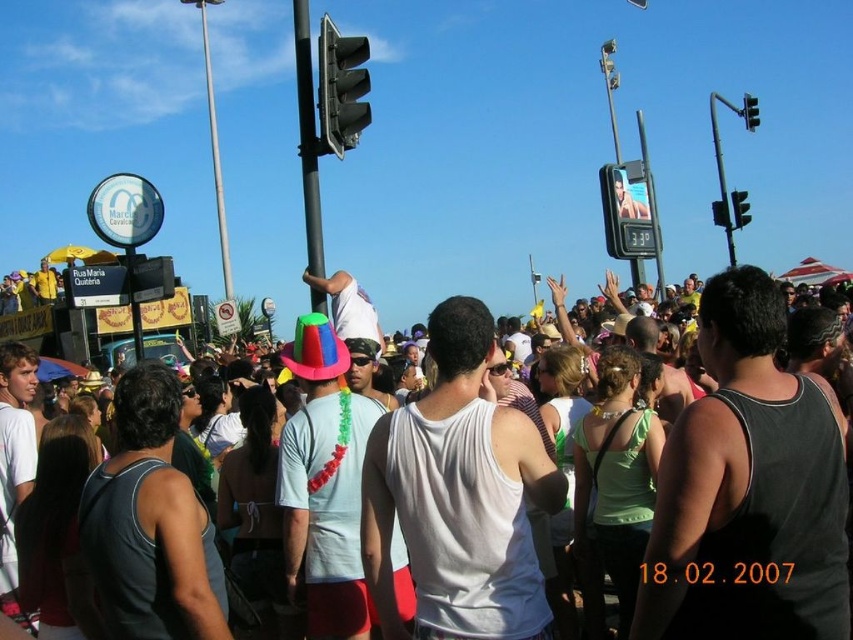
Can you confirm if metallic gray traffic light at upper center is positioned above black plastic traffic light at upper right?

Indeed, metallic gray traffic light at upper center is positioned over black plastic traffic light at upper right.

Between point (364, 38) and point (746, 214), which one is positioned behind?

The point (746, 214) is more distant.

At what (x,y) coordinates should I click in order to perform the action: click on metallic gray traffic light at upper center. Please return your answer as a coordinate pair (x, y). The width and height of the screenshot is (853, 640). Looking at the image, I should click on (341, 88).

Who is shorter, metallic pole at center or metallic traffic light at upper right?

Standing shorter between the two is metallic traffic light at upper right.

Can you confirm if metallic pole at center is shorter than metallic traffic light at upper right?

No, metallic pole at center is not shorter than metallic traffic light at upper right.

Is point (306, 108) positioned in front of point (750, 100)?

Yes, it is.

Find the location of a particular element. This screenshot has height=640, width=853. metallic pole at center is located at coordinates (306, 138).

Who is higher up, metallic pole at center or metallic traffic light at upper center?

metallic pole at center is above.

Consider the image. Can you confirm if metallic pole at center is smaller than metallic traffic light at upper center?

No.

At what (x,y) coordinates should I click in order to perform the action: click on metallic pole at center. Please return your answer as a coordinate pair (x, y). This screenshot has width=853, height=640. Looking at the image, I should click on (306, 138).